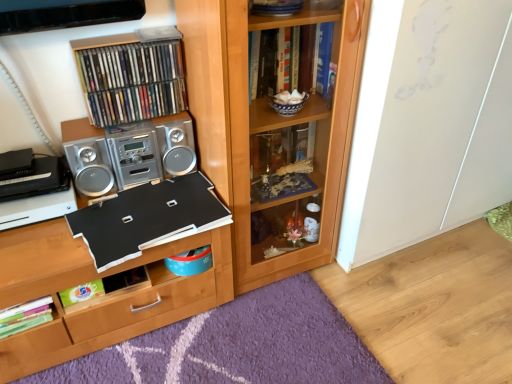
Describe the element at coordinates (128, 153) in the screenshot. The width and height of the screenshot is (512, 384). I see `silver metallic stereo at center` at that location.

What is the approximate height of transparent glass cabinet at center?

transparent glass cabinet at center is 3.70 feet tall.

What do you see at coordinates (132, 81) in the screenshot? The height and width of the screenshot is (384, 512). I see `metallic cd case at upper left, arranged as the 1th book when viewed from the top` at bounding box center [132, 81].

Where is `silver metallic stereo at center`? The image size is (512, 384). silver metallic stereo at center is located at coordinates (128, 153).

Is wooden bookcase at center aimed at metallic cd case at upper left, which appears as the 3th book when ordered from the bottom?

No, wooden bookcase at center is not facing towards metallic cd case at upper left, which appears as the 3th book when ordered from the bottom.

The height and width of the screenshot is (384, 512). In order to click on bookcase below the metallic cd case at upper left, which appears as the 3th book when ordered from the bottom (from the image's perspective) in this screenshot , I will do `click(271, 134)`.

In the image, is wooden bookcase at center positioned in front of or behind metallic cd case at upper left, arranged as the 1th book when viewed from the top?

wooden bookcase at center is in front of metallic cd case at upper left, arranged as the 1th book when viewed from the top.

Choose the correct answer: Is wooden bookcase at center inside metallic cd case at upper left, which appears as the 3th book when ordered from the bottom, or outside it?

wooden bookcase at center cannot be found inside metallic cd case at upper left, which appears as the 3th book when ordered from the bottom.

Which object is thinner, metallic cd case at upper left, which appears as the 3th book when ordered from the bottom, or silver metallic stereo at center?

metallic cd case at upper left, which appears as the 3th book when ordered from the bottom, is thinner.

This screenshot has width=512, height=384. Find the location of `stereo behind the metallic cd case at upper left, arranged as the 1th book when viewed from the top`. stereo behind the metallic cd case at upper left, arranged as the 1th book when viewed from the top is located at coordinates (128, 153).

From the image's perspective, between metallic cd case at upper left, arranged as the 1th book when viewed from the top, and silver metallic stereo at center, which one is located above?

From the image's view, metallic cd case at upper left, arranged as the 1th book when viewed from the top, is above.

Consider the image. Measure the distance from metallic cd case at upper left, arranged as the 1th book when viewed from the top, to silver metallic stereo at center.

metallic cd case at upper left, arranged as the 1th book when viewed from the top, and silver metallic stereo at center are 5.68 inches apart.

Which point is more forward, (105, 99) or (392, 159)?

Positioned in front is point (105, 99).

From the picture: From a real-world perspective, is metallic cd case at upper left, arranged as the 1th book when viewed from the top, physically located above or below transparent glass cabinet at center?

metallic cd case at upper left, arranged as the 1th book when viewed from the top, is above transparent glass cabinet at center.

Is metallic cd case at upper left, which appears as the 3th book when ordered from the bottom, directly adjacent to transparent glass cabinet at center?

There is a gap between metallic cd case at upper left, which appears as the 3th book when ordered from the bottom, and transparent glass cabinet at center.

From the image's perspective, which object appears higher, metallic cd case at upper left, arranged as the 1th book when viewed from the top, or black matte board at center, which is the third book in top-to-bottom order?

metallic cd case at upper left, arranged as the 1th book when viewed from the top, is shown above in the image.

Considering the relative sizes of metallic cd case at upper left, arranged as the 1th book when viewed from the top, and black matte board at center, which is the third book in top-to-bottom order, in the image provided, is metallic cd case at upper left, arranged as the 1th book when viewed from the top, smaller than black matte board at center, which is the third book in top-to-bottom order,?

Indeed, metallic cd case at upper left, arranged as the 1th book when viewed from the top, has a smaller size compared to black matte board at center, which is the third book in top-to-bottom order.

Does metallic cd case at upper left, arranged as the 1th book when viewed from the top, have a lesser height compared to black matte board at center, which is the third book in top-to-bottom order?

In fact, metallic cd case at upper left, arranged as the 1th book when viewed from the top, may be taller than black matte board at center, which is the third book in top-to-bottom order.

Is metallic cd case at upper left, arranged as the 1th book when viewed from the top, far from black matte board at center, which is the third book in top-to-bottom order?

No, metallic cd case at upper left, arranged as the 1th book when viewed from the top, is not far from black matte board at center, which is the third book in top-to-bottom order.

Is wooden bookcase at center directly adjacent to metallic silver stereo at upper left, which appears as the 2th book when ordered from the bottom?

There is a gap between wooden bookcase at center and metallic silver stereo at upper left, which appears as the 2th book when ordered from the bottom.

Is the position of wooden bookcase at center more distant than that of metallic silver stereo at upper left, the second book viewed from the top?

No.

Which of these two, wooden bookcase at center or metallic silver stereo at upper left, which appears as the 2th book when ordered from the bottom, is bigger?

wooden bookcase at center is bigger.

Measure the distance from wooden bookcase at center to metallic silver stereo at upper left, the second book viewed from the top.

wooden bookcase at center and metallic silver stereo at upper left, the second book viewed from the top, are 16.32 inches apart from each other.

Which object is more forward, wooden bookcase at center or black matte board at center?

wooden bookcase at center is in front.

Which of these two, wooden bookcase at center or black matte board at center, is thinner?

wooden bookcase at center is thinner.

Which point is more forward, [200,165] or [131,305]?

The point [131,305] is closer to the camera.

Could you tell me if wooden bookcase at center is turned towards black matte board at center?

No, wooden bookcase at center is not oriented towards black matte board at center.

From the image's perspective, does transparent glass cabinet at center appear higher than black matte board at center?

Correct, transparent glass cabinet at center appears higher than black matte board at center in the image.

Is point (395, 212) closer or farther from the camera than point (230, 244)?

Point (395, 212).

In the scene shown: Based on their sizes in the image, would you say transparent glass cabinet at center is bigger or smaller than black matte board at center?

transparent glass cabinet at center is bigger than black matte board at center.

Where is `shelf on the left of transparent glass cabinet at center`? shelf on the left of transparent glass cabinet at center is located at coordinates (101, 301).

Locate an element on the screen. bookcase on the right of metallic cd case at upper left, which appears as the 3th book when ordered from the bottom is located at coordinates tap(271, 134).

Find the location of `stereo behind the metallic cd case at upper left, which appears as the 3th book when ordered from the bottom`. stereo behind the metallic cd case at upper left, which appears as the 3th book when ordered from the bottom is located at coordinates (128, 153).

Considering their positions, is wooden bookcase at center positioned further to black matte board at center, which is counted as the 1th book, starting from the bottom, than purple shaggy rug at lower center?

purple shaggy rug at lower center.

Which object lies nearer to the anchor point metallic cd case at upper left, which appears as the 3th book when ordered from the bottom, metallic silver stereo at upper left, the second book viewed from the top, or black matte board at center?

Based on the image, metallic silver stereo at upper left, the second book viewed from the top, appears to be nearer to metallic cd case at upper left, which appears as the 3th book when ordered from the bottom.

When comparing their distances from silver metallic stereo at center, does black matte board at center or purple shaggy rug at lower center seem closer?

black matte board at center lies closer to silver metallic stereo at center than the other object.

Which object lies nearer to the anchor point silver metallic stereo at center, purple shaggy rug at lower center or transparent glass cabinet at center?

Among the two, purple shaggy rug at lower center is located nearer to silver metallic stereo at center.

Looking at the image, which one is located closer to purple shaggy rug at lower center, transparent glass cabinet at center or wooden bookcase at center?

Among the two, wooden bookcase at center is located nearer to purple shaggy rug at lower center.

From the picture: When comparing their distances from black matte board at center, does purple shaggy rug at lower center or transparent glass cabinet at center seem further?

transparent glass cabinet at center is positioned further to the anchor black matte board at center.

When comparing their distances from metallic cd case at upper left, arranged as the 1th book when viewed from the top, does black matte board at center or metallic silver stereo at upper left, the second book viewed from the top, seem further?

black matte board at center lies further to metallic cd case at upper left, arranged as the 1th book when viewed from the top, than the other object.

When comparing their distances from black matte board at center, does metallic silver stereo at upper left, the second book viewed from the top, or wooden bookcase at center seem further?

metallic silver stereo at upper left, the second book viewed from the top, is further to black matte board at center.

Identify the location of stereo between black matte board at center and wooden bookcase at center. The height and width of the screenshot is (384, 512). (128, 153).

You are a GUI agent. You are given a task and a screenshot of the screen. Output one action in this format:
    pyautogui.click(x=<x>, y=<y>)
    Task: Click on the bookcase located between black matte board at center, which is counted as the 1th book, starting from the bottom, and transparent glass cabinet at center in the left-right direction
    
    Given the screenshot: What is the action you would take?
    pyautogui.click(x=271, y=134)

I want to click on book between wooden bookcase at center and purple shaggy rug at lower center vertically, so click(148, 218).

This screenshot has height=384, width=512. I want to click on stereo between black matte board at center and transparent glass cabinet at center from left to right, so click(x=128, y=153).